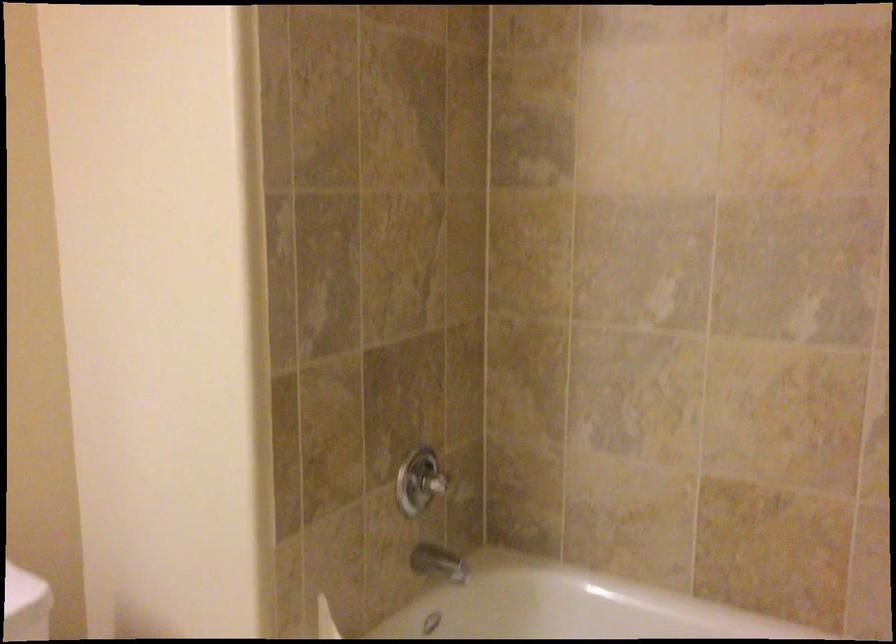
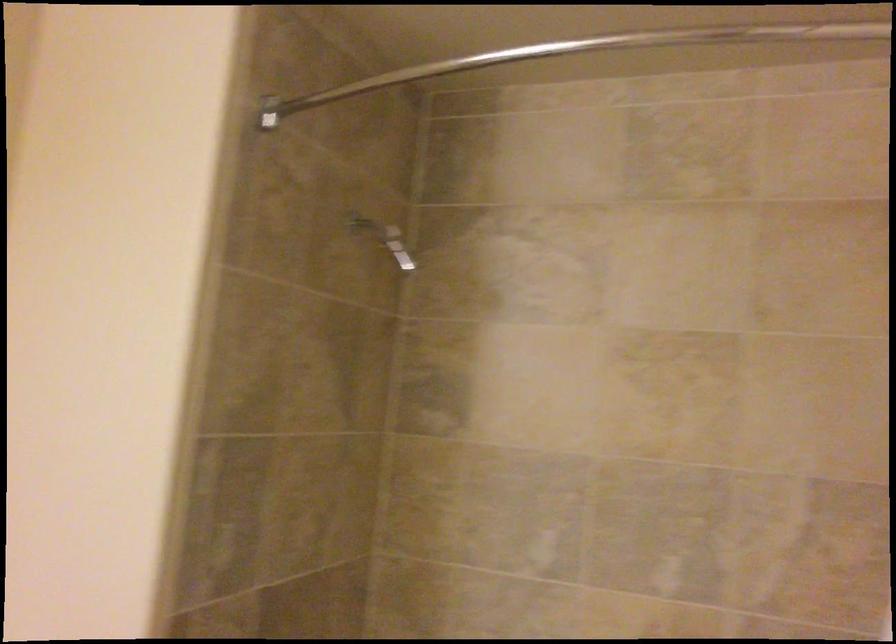
The images are taken continuously from a first-person perspective. In which direction are you moving?

The cameraman moved toward left, backward.